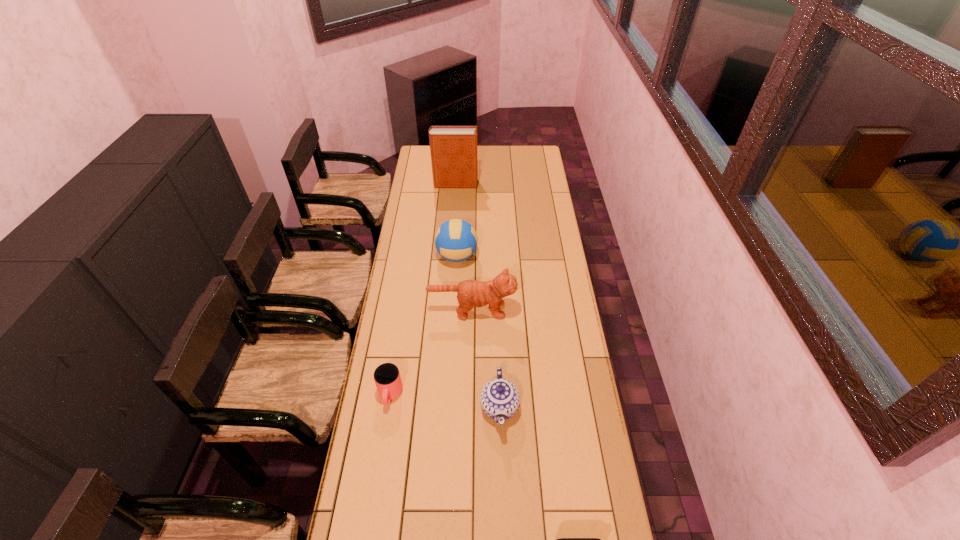
I want to click on free space between the chinaware and the cat, so click(486, 359).

Where is `empty location between the fifth nearest object and the chinaware`? empty location between the fifth nearest object and the chinaware is located at coordinates (478, 332).

At what (x,y) coordinates should I click in order to perform the action: click on vacant region between the volleyball and the chinaware. Please return your answer as a coordinate pair (x, y). Image resolution: width=960 pixels, height=540 pixels. Looking at the image, I should click on (478, 332).

Identify which object is located as the fifth nearest to the cup. Please provide its 2D coordinates. Your answer should be formatted as a tuple, i.e. [(x, y)], where the tuple contains the x and y coordinates of a point satisfying the conditions above.

[(453, 149)]

In order to click on object that can be found as the fourth closest to the chinaware in this screenshot , I will do `click(456, 240)`.

Find the location of a particular element. free space that satisfies the following two spatial constraints: 1. on the face of the third farthest object; 2. on the handle side of the leftmost object is located at coordinates (470, 395).

The image size is (960, 540). I want to click on free space that satisfies the following two spatial constraints: 1. on the face of the cat; 2. on the handle side of the leftmost object, so click(470, 395).

The image size is (960, 540). I want to click on vacant area that satisfies the following two spatial constraints: 1. on the open cover of the farthest object; 2. on the right side of the volleyball, so click(450, 256).

Where is `free location that satisfies the following two spatial constraints: 1. on the open cover of the farthest object; 2. on the back side of the fifth nearest object`? The height and width of the screenshot is (540, 960). free location that satisfies the following two spatial constraints: 1. on the open cover of the farthest object; 2. on the back side of the fifth nearest object is located at coordinates (450, 256).

Where is `vacant point that satisfies the following two spatial constraints: 1. on the back side of the volleyball; 2. on the open cover of the hardback book`? This screenshot has width=960, height=540. vacant point that satisfies the following two spatial constraints: 1. on the back side of the volleyball; 2. on the open cover of the hardback book is located at coordinates (461, 184).